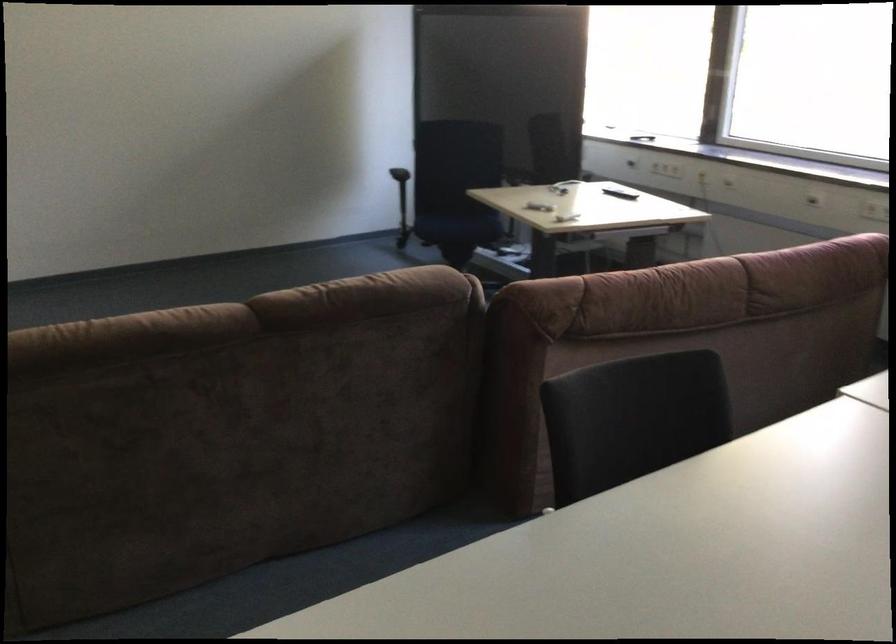
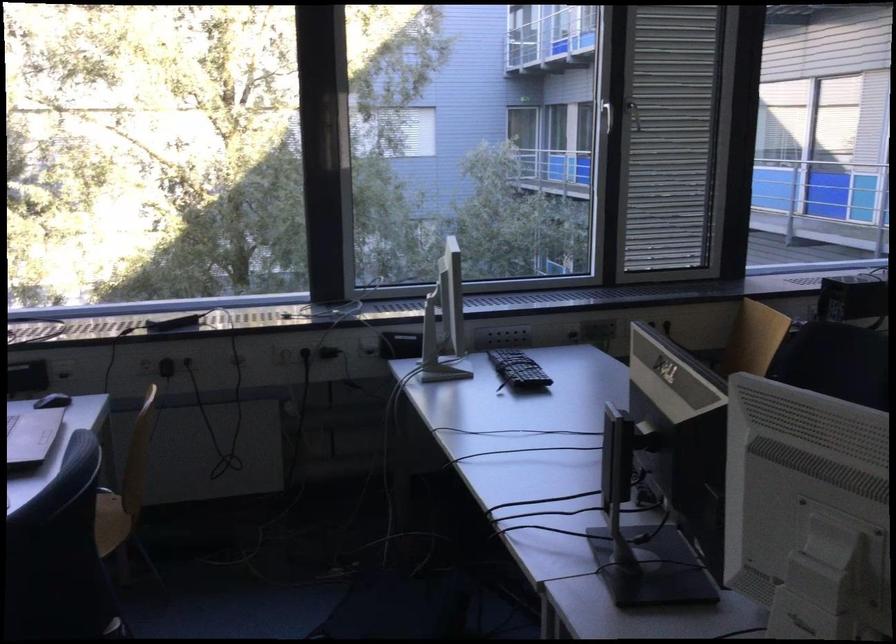
Question: The camera is either moving clockwise (left) or counter-clockwise (right) around the object. The first image is from the beginning of the video and the second image is from the end. Is the camera moving left or right when shooting the video?

Choices:
 (A) Left
 (B) Right

Answer: (A)